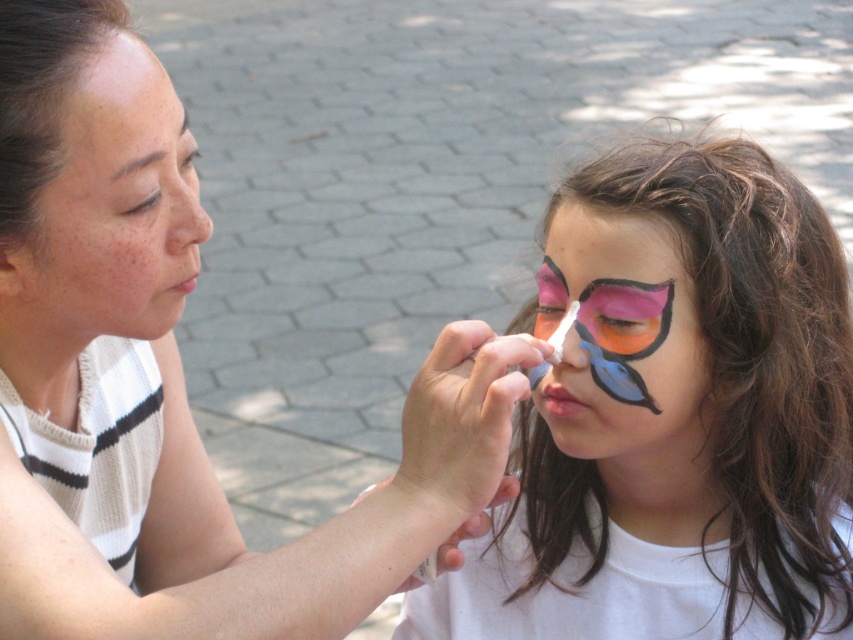
You are a photographer standing 2 feet away from the scene. You want to take a closeup shot of the smooth skin at upper left without the matte white shirt at center appearing in the frame. Is this possible given their current positions?

The distance between the matte white shirt at center and the smooth skin at upper left is 3.02 inches. Since you are 2 feet away, which is approximately 24 inches, you can adjust your angle or zoom to focus on the smooth skin at upper left while keeping the matte white shirt at center out of the frame as they are separated by a sufficient distance.